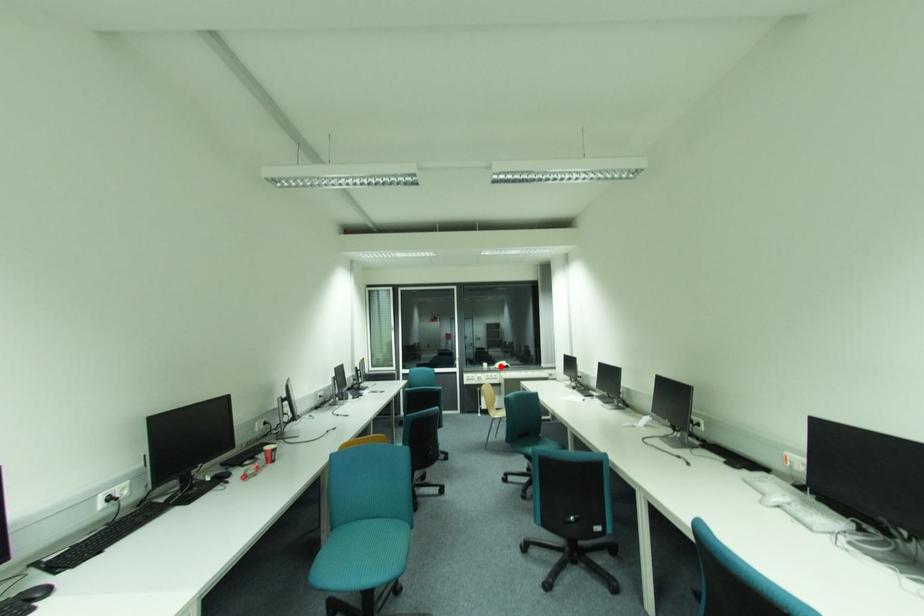
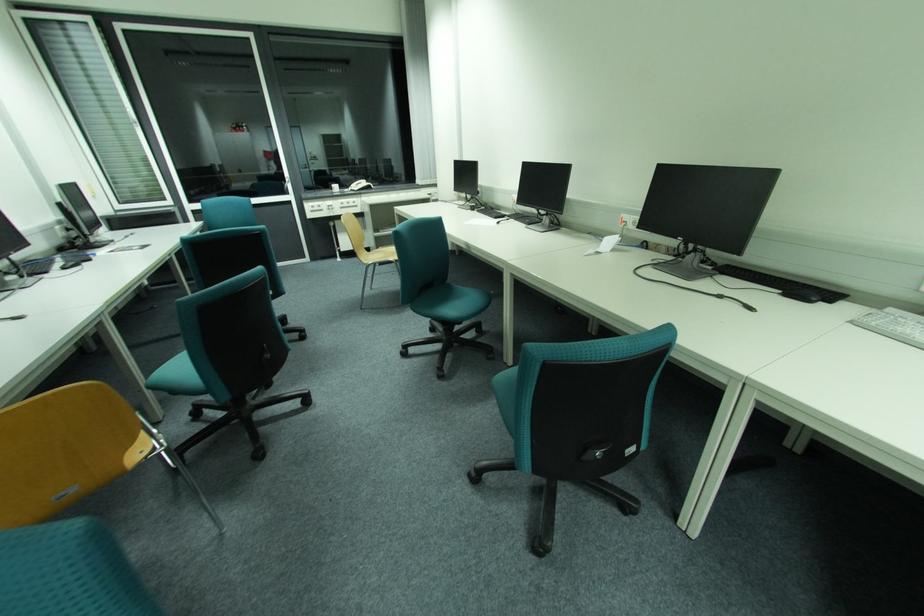
The point at the highlighted location is marked in the first image. Where is the corresponding point in the second image?

(357, 188)